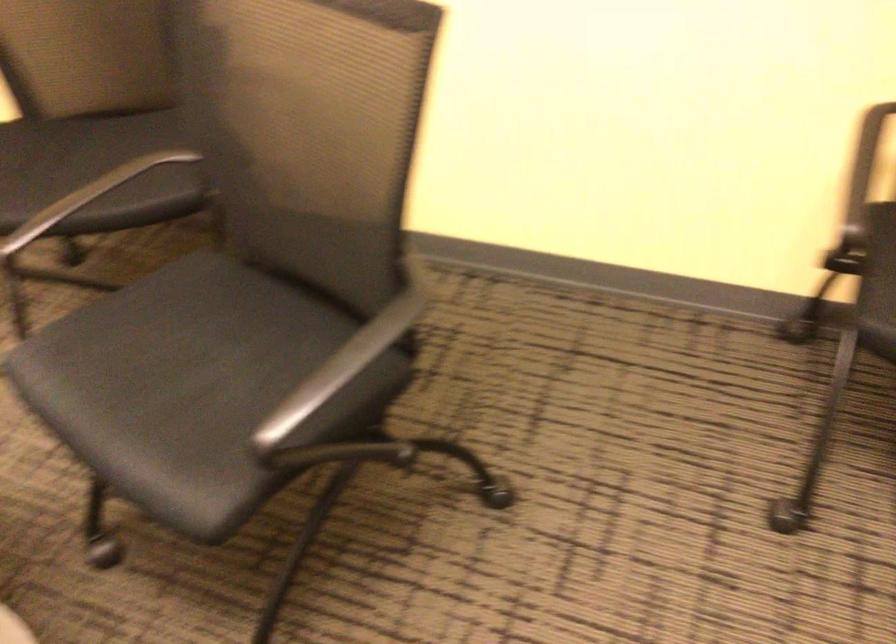
Question: The camera is either moving clockwise (left) or counter-clockwise (right) around the object. The first image is from the beginning of the video and the second image is from the end. Is the camera moving left or right when shooting the video?

Choices:
 (A) Left
 (B) Right

Answer: (B)